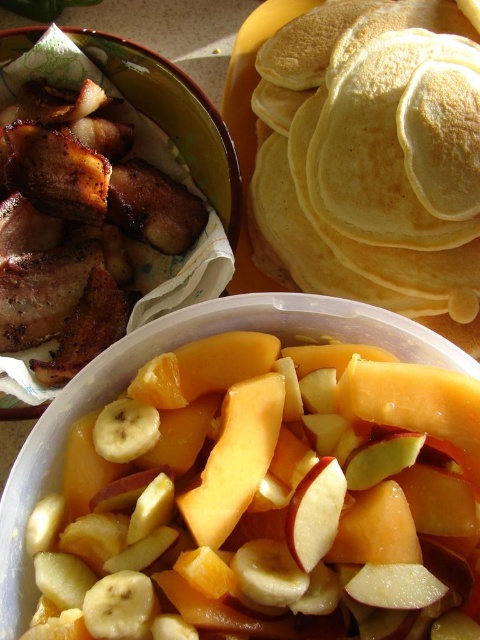
Which is below, sliced orange at center or yellow soft pancakes at upper right?

sliced orange at center is below.

What do you see at coordinates (269, 500) in the screenshot?
I see `sliced orange at center` at bounding box center [269, 500].

At what (x,y) coordinates should I click in order to perform the action: click on sliced orange at center. Please return your answer as a coordinate pair (x, y). This screenshot has width=480, height=640. Looking at the image, I should click on (269, 500).

Looking at this image, is yellow soft pancakes at upper right behind yellow matte banana at center?

Yes, yellow soft pancakes at upper right is behind yellow matte banana at center.

Who is positioned more to the right, yellow soft pancakes at upper right or yellow matte banana at center?

yellow soft pancakes at upper right

Who is more distant from viewer, (x=453, y=192) or (x=144, y=440)?

Positioned behind is point (x=453, y=192).

Where is `yellow soft pancakes at upper right`? The height and width of the screenshot is (640, 480). yellow soft pancakes at upper right is located at coordinates (374, 157).

Is sliced orange at center to the left of yellow matte banana at center from the viewer's perspective?

Incorrect, sliced orange at center is not on the left side of yellow matte banana at center.

Does sliced orange at center have a greater width compared to yellow matte banana at center?

Indeed, sliced orange at center has a greater width compared to yellow matte banana at center.

The image size is (480, 640). Describe the element at coordinates (269, 500) in the screenshot. I see `sliced orange at center` at that location.

Where is `sliced orange at center`? The width and height of the screenshot is (480, 640). sliced orange at center is located at coordinates (x=269, y=500).